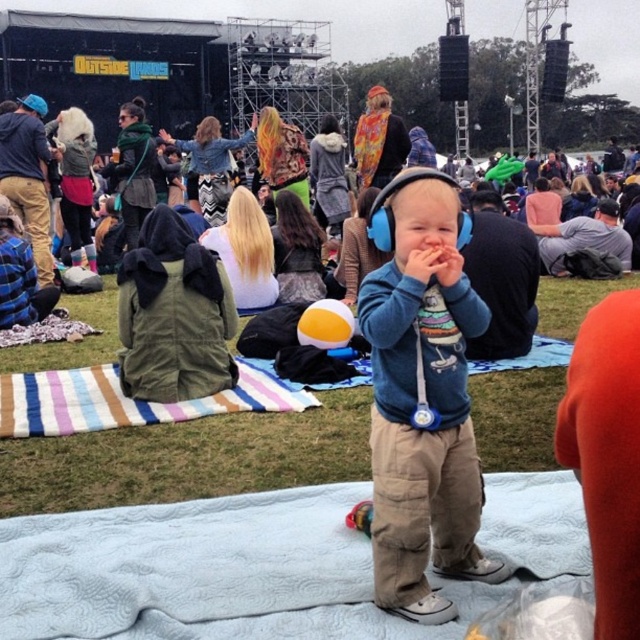
You are a photographer at the Outside Lands festival. You want to capture a photo of the blue quilted blanket at center and the blue fabric headphones at center in the same frame. Which object should you focus on first to ensure both are in the frame?

The blue quilted blanket at center is shorter than blue fabric headphones at center, so you should focus on the blue quilted blanket at center first to ensure both are in the frame.

You are at the music festival and want to find the blue quilted blanket at center. According to the coordinates provided, where exactly is it positioned?

The blue quilted blanket at center is located at point (208, 572).

In the scene shown: You are setting up a music festival attendee. You have a blue quilted blanket at center and blue fabric headphones at center. Which item can you place on a standard 12x12 inch table without folding?

The blue quilted blanket at center is bigger than blue fabric headphones at center. Therefore, the blue fabric headphones at center can be placed on the table without folding, while the blanket would require folding due to its larger size.